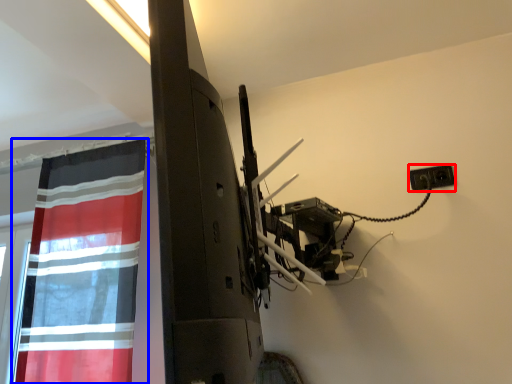
Question: Which object appears farthest to the camera in this image, electric outlet (highlighted by a red box) or curtain (highlighted by a blue box)?

Choices:
 (A) electric outlet
 (B) curtain

Answer: (A)